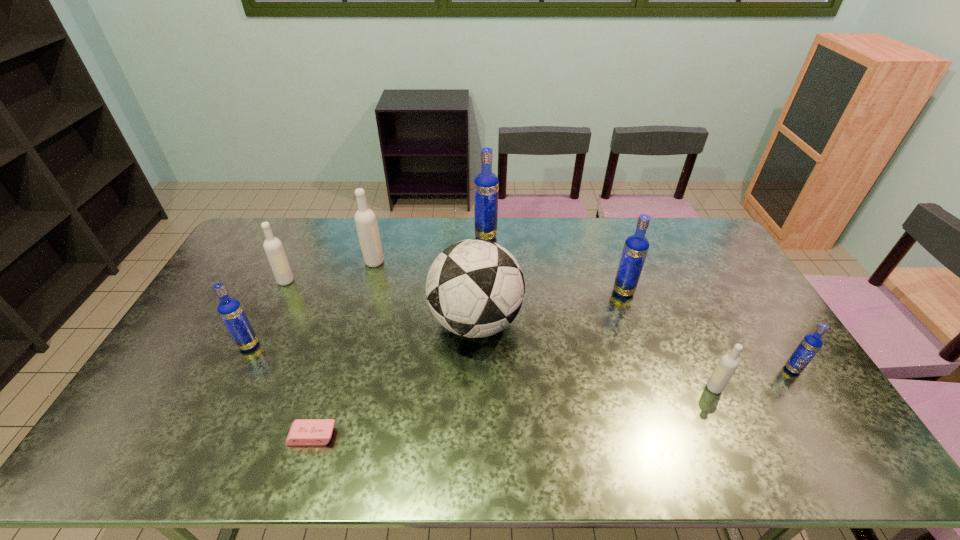
The image size is (960, 540). I want to click on empty location between the fifth vodka from right to left and the soccer ball, so click(425, 292).

Image resolution: width=960 pixels, height=540 pixels. Identify the location of free area in between the third nearest object and the farthest vodka. (639, 303).

Point out which object is positioned as the seventh nearest to the second nearest blue vodka. Please provide its 2D coordinates. Your answer should be formatted as a tuple, i.e. [(x, y)], where the tuple contains the x and y coordinates of a point satisfying the conditions above.

[(728, 363)]

Select which object is the sixth closest to the shortest object. Please provide its 2D coordinates. Your answer should be formatted as a tuple, i.e. [(x, y)], where the tuple contains the x and y coordinates of a point satisfying the conditions above.

[(636, 246)]

Choose which vodka is the sixth nearest neighbor to the rightmost blue vodka. Please provide its 2D coordinates. Your answer should be formatted as a tuple, i.e. [(x, y)], where the tuple contains the x and y coordinates of a point satisfying the conditions above.

[(273, 247)]

Point out which vodka is positioned as the fifth nearest to the fifth vodka from left to right. Please provide its 2D coordinates. Your answer should be formatted as a tuple, i.e. [(x, y)], where the tuple contains the x and y coordinates of a point satisfying the conditions above.

[(273, 247)]

Locate which blue vodka is the closest to the leftmost blue vodka. Please provide its 2D coordinates. Your answer should be formatted as a tuple, i.e. [(x, y)], where the tuple contains the x and y coordinates of a point satisfying the conditions above.

[(486, 184)]

Where is `blue vodka that is the third closest to the leftmost blue vodka`? Image resolution: width=960 pixels, height=540 pixels. blue vodka that is the third closest to the leftmost blue vodka is located at coordinates pos(810,345).

Choose which white vodka is the third nearest neighbor to the soccer ball. Please provide its 2D coordinates. Your answer should be formatted as a tuple, i.e. [(x, y)], where the tuple contains the x and y coordinates of a point satisfying the conditions above.

[(728, 363)]

This screenshot has width=960, height=540. Identify the location of white vodka that is the third closest to the second smallest blue vodka. (728, 363).